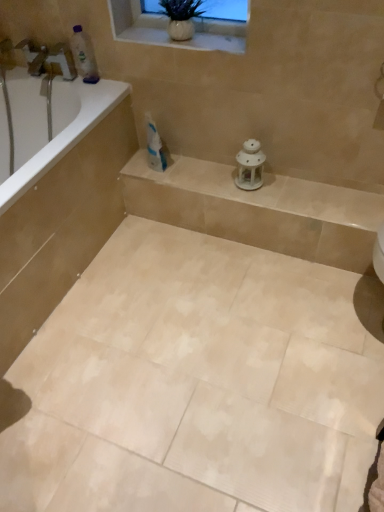
Question: From a real-world perspective, is beige ceramic tile at center physically located above or below white glossy bathtub at upper left?

Choices:
 (A) above
 (B) below

Answer: (B)

Question: Does point (375, 362) appear closer or farther from the camera than point (66, 139)?

Choices:
 (A) farther
 (B) closer

Answer: (B)

Question: Based on their relative distances, which object is farther from the white glossy toothpaste at center?

Choices:
 (A) translucent plastic bottle at upper left
 (B) white porcelain lantern at center
 (C) white glossy bathtub at left
 (D) beige ceramic tile at center
 (E) white ceramic lantern at center

Answer: (D)

Question: Based on their relative distances, which object is nearer to the white glossy toothpaste at center?

Choices:
 (A) white ceramic vase at upper center
 (B) white glossy bathtub at left
 (C) white ceramic lantern at center
 (D) translucent plastic bottle at upper left
 (E) white glossy bathtub at upper left

Answer: (D)